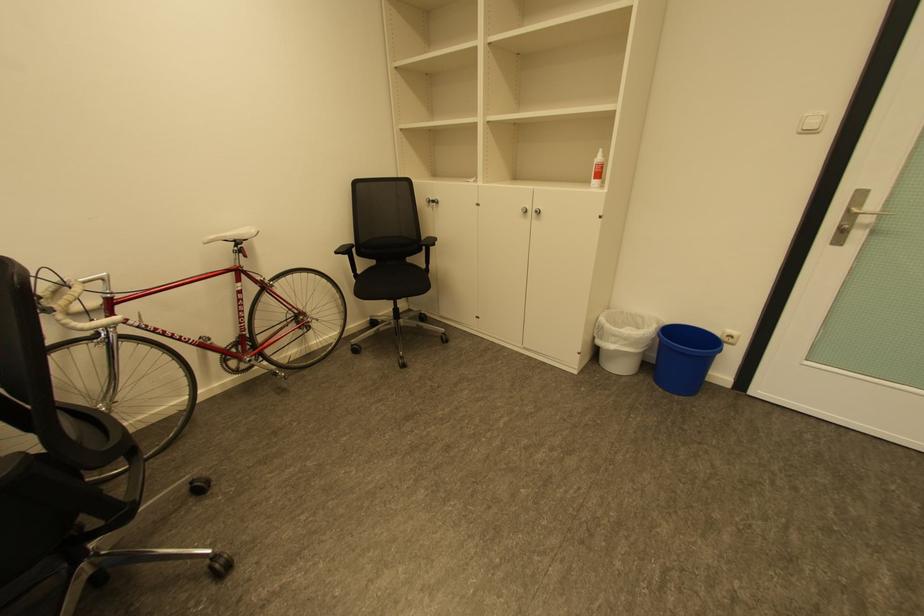
The image size is (924, 616). Find the location of `silver door handle`. silver door handle is located at coordinates (865, 213).